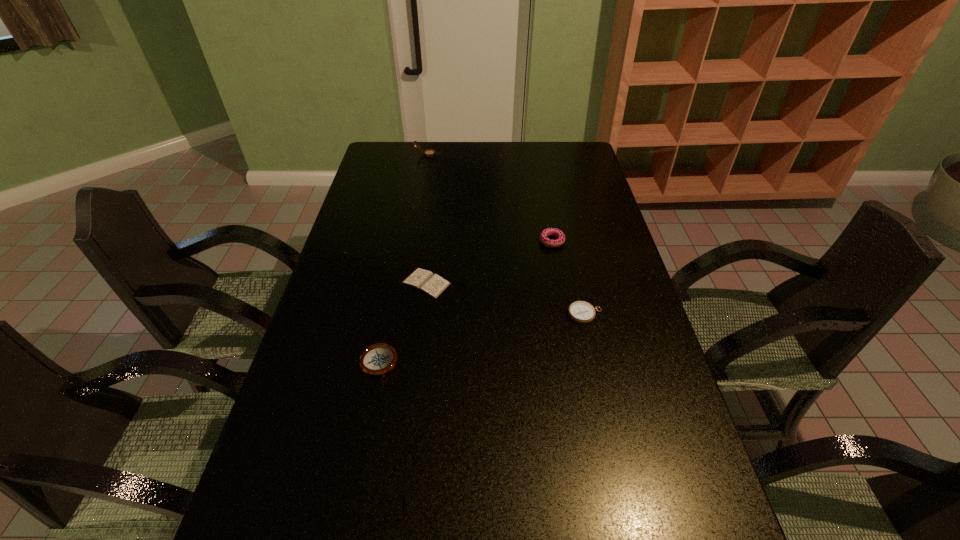
This screenshot has height=540, width=960. What are the coordinates of `vacant point that satisfies the following two spatial constraints: 1. on the back side of the nearest object; 2. on the left side of the third farthest object` in the screenshot? It's located at (395, 284).

Where is `vacant position in the image that satisfies the following two spatial constraints: 1. on the face of the tallest object; 2. on the left side of the second farthest object`? Image resolution: width=960 pixels, height=540 pixels. vacant position in the image that satisfies the following two spatial constraints: 1. on the face of the tallest object; 2. on the left side of the second farthest object is located at coordinates (413, 241).

Image resolution: width=960 pixels, height=540 pixels. Find the location of `blank space that satisfies the following two spatial constraints: 1. on the face of the farthest compass; 2. on the left side of the rightmost compass`. blank space that satisfies the following two spatial constraints: 1. on the face of the farthest compass; 2. on the left side of the rightmost compass is located at coordinates (400, 314).

Find the location of `free space in the image that satisfies the following two spatial constraints: 1. on the face of the shortest compass; 2. on the left side of the farthest object`. free space in the image that satisfies the following two spatial constraints: 1. on the face of the shortest compass; 2. on the left side of the farthest object is located at coordinates pyautogui.click(x=400, y=314).

Image resolution: width=960 pixels, height=540 pixels. Find the location of `free spot that satisfies the following two spatial constraints: 1. on the front side of the shortest compass; 2. on the left side of the shortest object`. free spot that satisfies the following two spatial constraints: 1. on the front side of the shortest compass; 2. on the left side of the shortest object is located at coordinates (422, 314).

This screenshot has width=960, height=540. I want to click on free spot that satisfies the following two spatial constraints: 1. on the back side of the third nearest object; 2. on the face of the farthest compass, so click(443, 154).